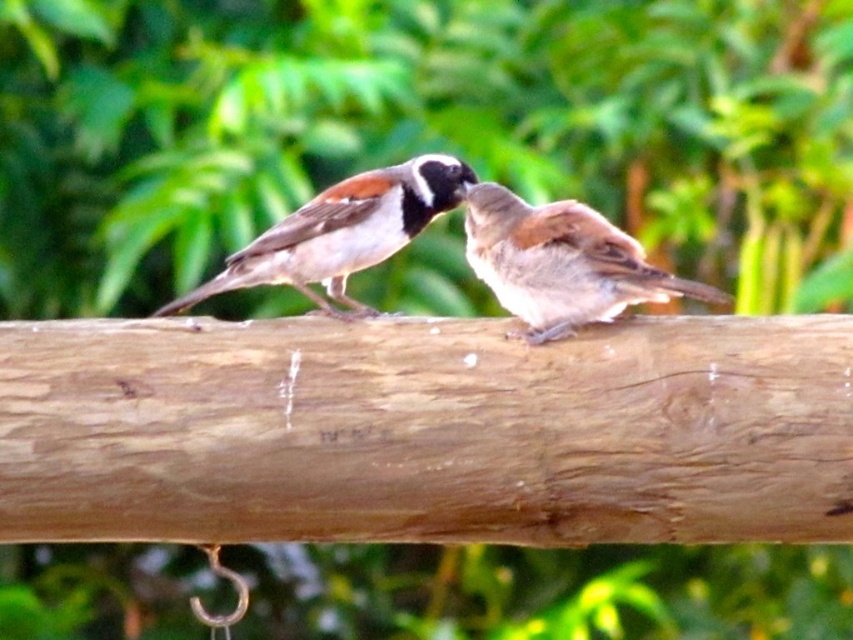
Question: Does brown feathered sparrow at center have a greater width compared to brown speckled feathers at center?

Choices:
 (A) no
 (B) yes

Answer: (A)

Question: Does brown wood log at center appear over brown feathered sparrow at center?

Choices:
 (A) no
 (B) yes

Answer: (A)

Question: Which of the following is the closest to the observer?

Choices:
 (A) brown speckled feathers at center
 (B) brown feathered sparrow at center

Answer: (B)

Question: Which object is farther from the camera taking this photo?

Choices:
 (A) brown wood log at center
 (B) brown feathered sparrow at center

Answer: (A)

Question: Can you confirm if brown feathered sparrow at center is wider than brown speckled feathers at center?

Choices:
 (A) no
 (B) yes

Answer: (A)

Question: Which object is the farthest from the brown speckled feathers at center?

Choices:
 (A) brown wood log at center
 (B) brown feathered sparrow at center

Answer: (A)